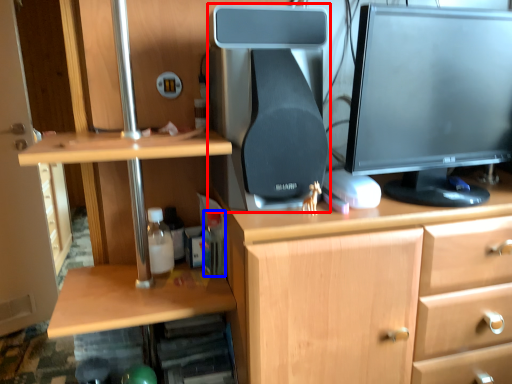
Question: Which of the following is the farthest to the observer, desktop computer (highlighted by a red box) or bottle (highlighted by a blue box)?

Choices:
 (A) desktop computer
 (B) bottle

Answer: (B)